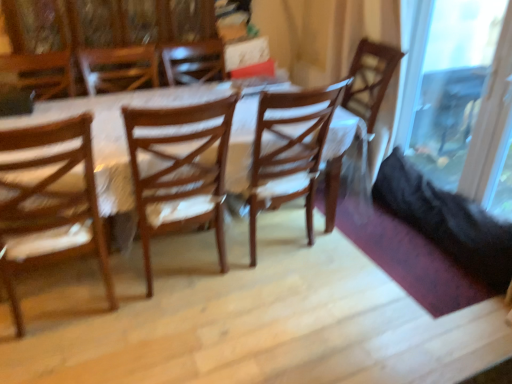
Question: From the image's perspective, would you say wooden chair at left, acting as the third chair starting from the right, is positioned over wooden chair at center, placed as the third chair when sorted from left to right?

Choices:
 (A) no
 (B) yes

Answer: (A)

Question: Can you confirm if wooden chair at left, the first chair in the left-to-right sequence, is wider than wooden chair at center, placed as the third chair when sorted from left to right?

Choices:
 (A) no
 (B) yes

Answer: (B)

Question: From a real-world perspective, does wooden chair at left, the first chair in the left-to-right sequence, stand above wooden chair at center, which is counted as the first chair, starting from the right?

Choices:
 (A) yes
 (B) no

Answer: (A)

Question: Would you consider wooden chair at left, acting as the third chair starting from the right, to be distant from wooden chair at center, which is counted as the first chair, starting from the right?

Choices:
 (A) no
 (B) yes

Answer: (B)

Question: Can we say wooden chair at left, acting as the third chair starting from the right, lies outside wooden chair at center, which is counted as the first chair, starting from the right?

Choices:
 (A) yes
 (B) no

Answer: (A)

Question: Is transparent glass door at right wider or thinner than wooden chair at left, the first chair in the left-to-right sequence?

Choices:
 (A) thin
 (B) wide

Answer: (A)

Question: Would you say transparent glass door at right is to the left or to the right of wooden chair at left, the first chair in the left-to-right sequence, in the picture?

Choices:
 (A) left
 (B) right

Answer: (B)

Question: Is transparent glass door at right in front of or behind wooden chair at left, acting as the third chair starting from the right, in the image?

Choices:
 (A) behind
 (B) front

Answer: (A)

Question: Would you say transparent glass door at right is inside or outside wooden chair at left, the first chair in the left-to-right sequence?

Choices:
 (A) inside
 (B) outside

Answer: (B)

Question: Which is correct: wooden chair at left, acting as the third chair starting from the right, is inside transparent glass door at right, or outside of it?

Choices:
 (A) inside
 (B) outside

Answer: (B)

Question: Based on their sizes in the image, would you say wooden chair at left, the first chair in the left-to-right sequence, is bigger or smaller than transparent glass door at right?

Choices:
 (A) big
 (B) small

Answer: (A)

Question: Is point (47, 127) positioned closer to the camera than point (501, 165)?

Choices:
 (A) farther
 (B) closer

Answer: (B)

Question: From their relative heights in the image, would you say wooden chair at left, acting as the third chair starting from the right, is taller or shorter than transparent glass door at right?

Choices:
 (A) short
 (B) tall

Answer: (A)

Question: Is wooden chair at center, the second chair in the right-to-left sequence, taller or shorter than wooden chair at left, acting as the third chair starting from the right?

Choices:
 (A) short
 (B) tall

Answer: (A)

Question: From the image's perspective, is wooden chair at center, the second chair viewed from the left, above or below wooden chair at left, the first chair in the left-to-right sequence?

Choices:
 (A) above
 (B) below

Answer: (A)